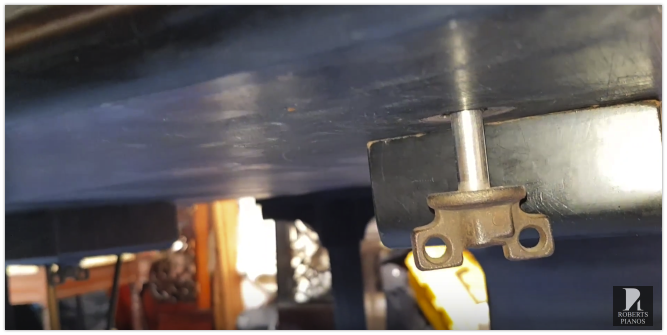
You are a GUI agent. You are given a task and a screenshot of the screen. Output one action in this format:
    pyautogui.click(x=<x>, y=<y>)
    Task: Click on the desk
    This screenshot has width=667, height=335.
    Given the screenshot: What is the action you would take?
    pyautogui.click(x=311, y=100)